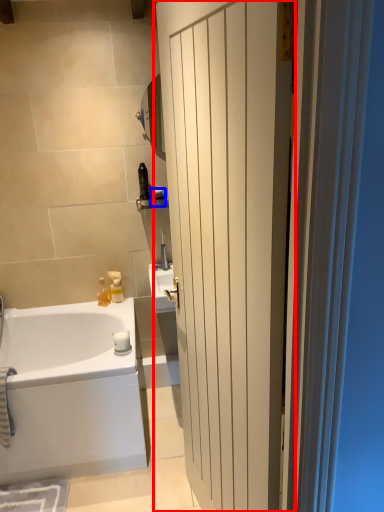
Question: Among these objects, which one is nearest to the camera, door (highlighted by a red box) or toiletry (highlighted by a blue box)?

Choices:
 (A) door
 (B) toiletry

Answer: (A)